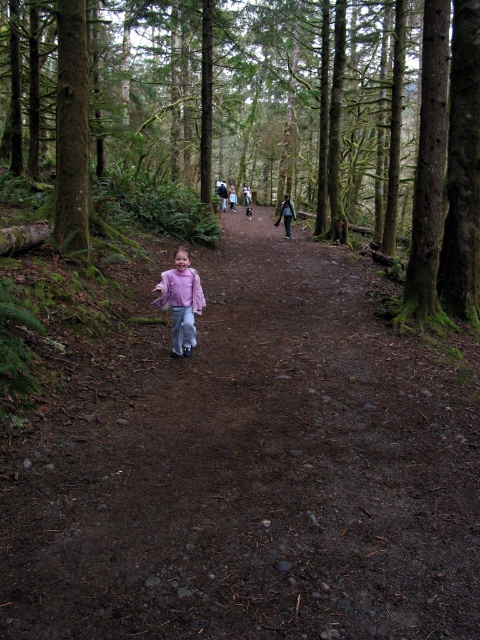
You are standing at the center of the forest and want to find the brown dirt path at center. According to the coordinates provided, where should you look to find it?

The brown dirt path at center is located at coordinates point (252, 468).